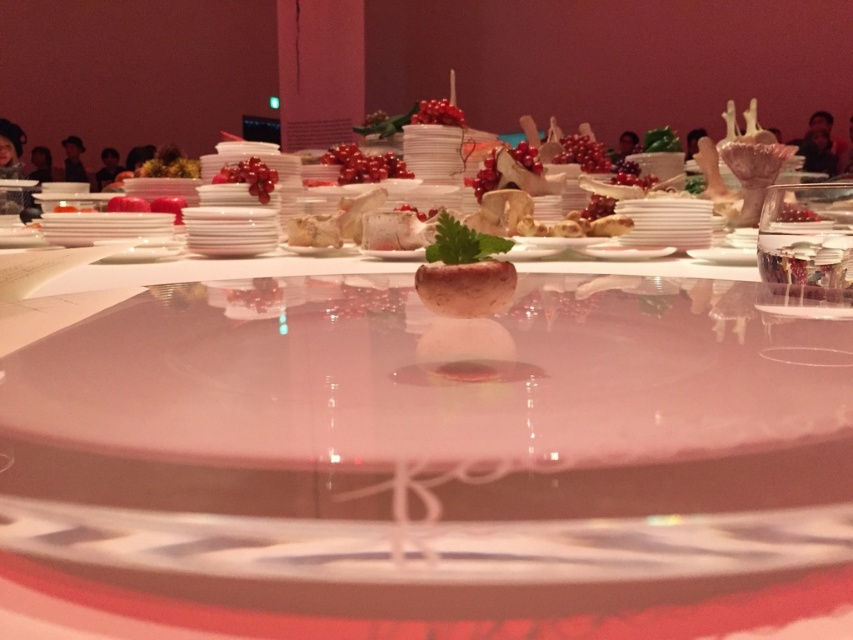
You are a server at a formal event and need to determine which of the two berry clusters, the shiny red berries at upper center or the glossy red berries at center, is smaller in size to adjust the plate arrangement. Which one should you choose?

The shiny red berries at upper center occupies less space than glossy red berries at center, so you should choose the shiny red berries at upper center as it is smaller in size.

In the scene shown: You are a guest at the dining table and want to place a napkin on the table. The server says you should place it near the shiny red berries at center. Where should you place the napkin?

You should place the napkin near the shiny red berries at center, which is located at the coordinates (363,164) on the table.